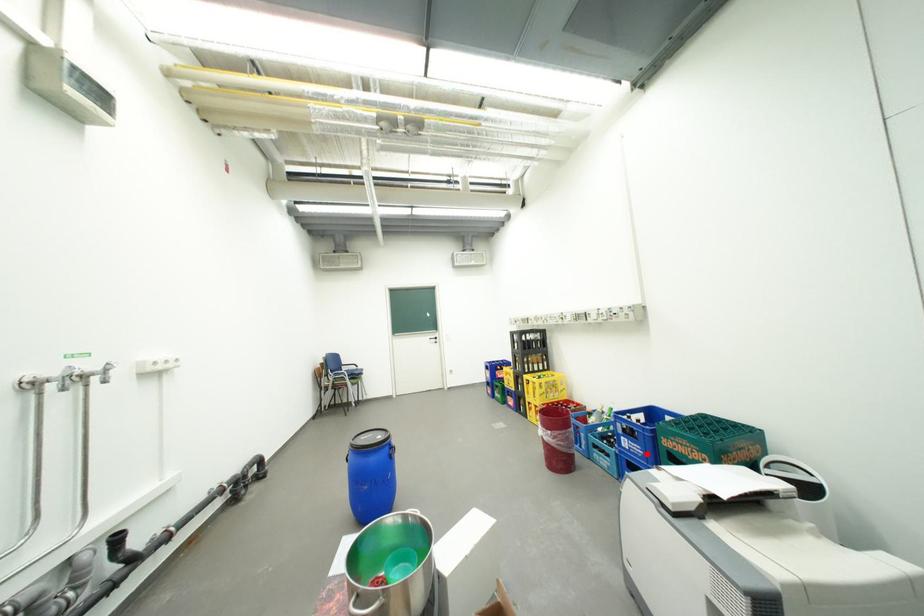
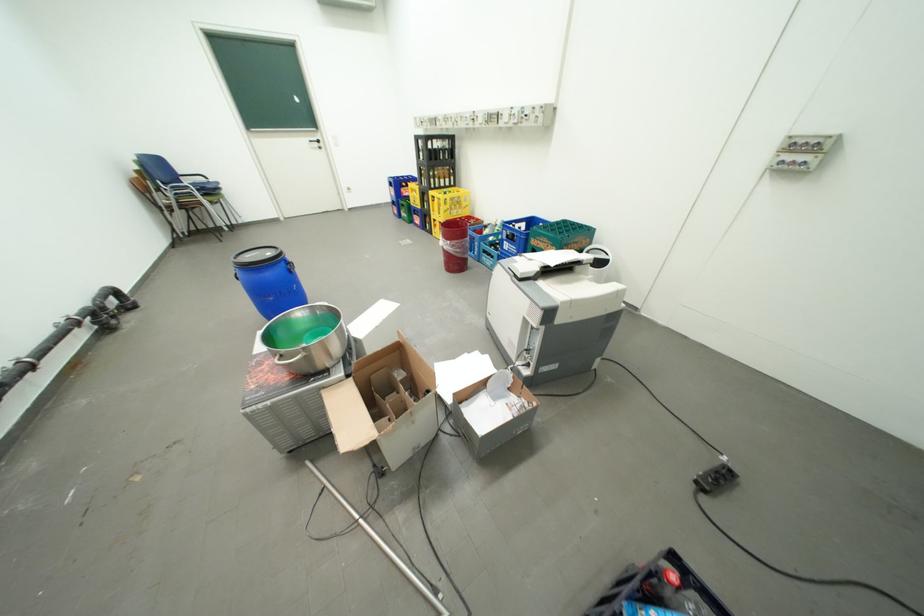
The point at the highlighted location is marked in the first image. Where is the corresponding point in the second image?

(523, 253)